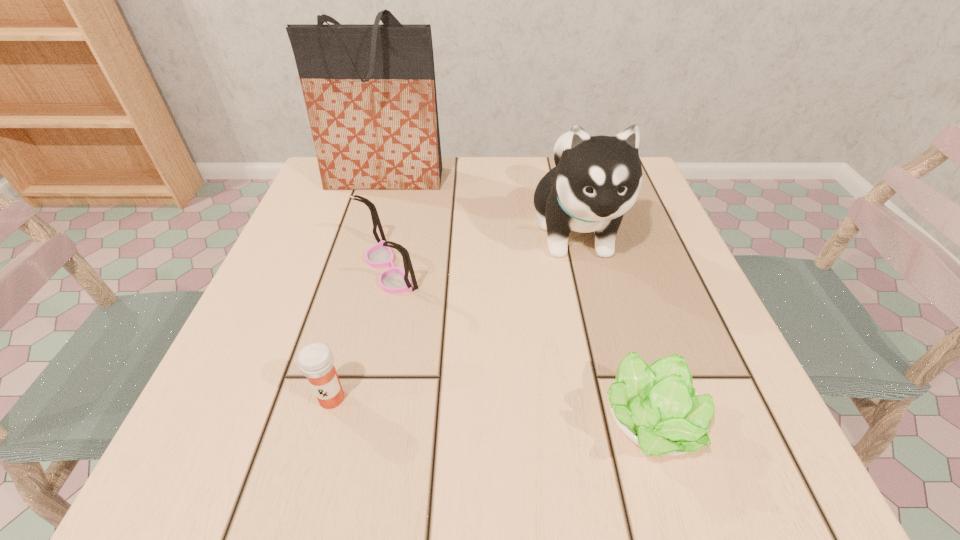
Where is `shopping bag`? The width and height of the screenshot is (960, 540). shopping bag is located at coordinates (370, 93).

What are the coordinates of `puppy` in the screenshot? It's located at (597, 179).

The height and width of the screenshot is (540, 960). I want to click on spectacles, so click(394, 280).

This screenshot has height=540, width=960. Find the location of `medicine`. medicine is located at coordinates (316, 362).

Find the location of `the shortest object`. the shortest object is located at coordinates (656, 406).

At what (x,y) coordinates should I click in order to perform the action: click on free space located on the front-facing side of the tallest object. Please return your answer as a coordinate pair (x, y). This screenshot has width=960, height=540. Looking at the image, I should click on (367, 242).

Locate an element on the screen. vacant region located at the face of the fourth shortest object is located at coordinates [598, 322].

This screenshot has height=540, width=960. I want to click on vacant region located 0.240m on the right of the third tallest object, so click(x=549, y=269).

This screenshot has width=960, height=540. Find the location of `free region located 0.090m on the label side of the medicine`. free region located 0.090m on the label side of the medicine is located at coordinates (310, 477).

Identify the location of free region located 0.100m on the left of the shortest object. The width and height of the screenshot is (960, 540). (524, 424).